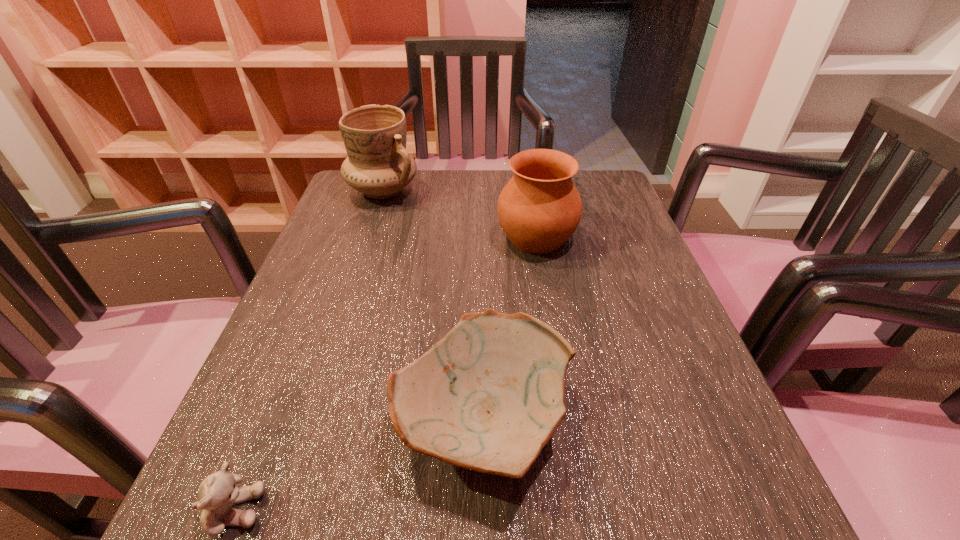
Where is `the closest object to the farthest pottery`? The image size is (960, 540). the closest object to the farthest pottery is located at coordinates (539, 209).

Select which object is the third closest to the farthest pottery. Please provide its 2D coordinates. Your answer should be formatted as a tuple, i.e. [(x, y)], where the tuple contains the x and y coordinates of a point satisfying the conditions above.

[(218, 492)]

Select which pottery is the closest to the teddy bear. Please provide its 2D coordinates. Your answer should be formatted as a tuple, i.e. [(x, y)], where the tuple contains the x and y coordinates of a point satisfying the conditions above.

[(488, 397)]

Select which pottery appears as the second closest to the farthest object. Please provide its 2D coordinates. Your answer should be formatted as a tuple, i.e. [(x, y)], where the tuple contains the x and y coordinates of a point satisfying the conditions above.

[(488, 397)]